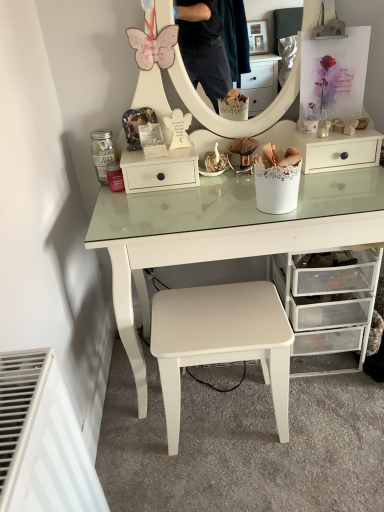
Locate an element on the screen. This screenshot has width=384, height=512. white matte stool at center is located at coordinates (221, 341).

The image size is (384, 512). What do you see at coordinates (160, 170) in the screenshot?
I see `white matte drawer at center` at bounding box center [160, 170].

I want to click on white matte stool at center, so click(x=221, y=341).

Does white matte drawer at center have a larger size compared to white matte stool at center?

No, white matte drawer at center is not bigger than white matte stool at center.

Does white matte drawer at center turn towards white matte stool at center?

No, white matte drawer at center is not facing towards white matte stool at center.

Would you consider white matte drawer at center to be distant from white matte stool at center?

No, white matte drawer at center is not far away from white matte stool at center.

Between point (140, 183) and point (157, 348), which one is positioned behind?

The point (140, 183) is more distant.

This screenshot has width=384, height=512. There is a white matte stool at center. Identify the location of the chest of drawers above it (from a real-world perspective). (328, 304).

How far apart are clear plastic drawers at lower right and white matte stool at center?

clear plastic drawers at lower right and white matte stool at center are 10.93 inches apart from each other.

Which is behind, clear plastic drawers at lower right or white matte stool at center?

clear plastic drawers at lower right is more distant.

How different are the orientations of clear plastic drawers at lower right and white matte stool at center in degrees?

176 degrees.

Is there a large distance between white matte stool at center and white matte drawer at center?

No.

Which is closer, (286,387) or (146,181)?

Point (286,387).

Looking at this image, between white matte stool at center and white matte drawer at center, which one has more height?

white matte stool at center.

Find the location of a particular element. The image size is (384, 512). nightstand located above the white matte stool at center (from the image's perspective) is located at coordinates (160, 170).

Considering the positions of point (216, 285) and point (354, 272), is point (216, 285) closer or farther from the camera than point (354, 272)?

Point (216, 285) appears to be farther away from the viewer than point (354, 272).

Which object is wider, white matte stool at center or clear plastic drawers at lower right?

clear plastic drawers at lower right.

Is white matte stool at center smaller than clear plastic drawers at lower right?

Yes.

Can you confirm if white matte stool at center is positioned to the right of clear plastic drawers at lower right?

No, white matte stool at center is not to the right of clear plastic drawers at lower right.

Based on the photo, which is further, (139, 189) or (368, 250)?

The point (139, 189) is farther.

Is white matte drawer at center surrounding clear plastic drawers at lower right?

Actually, clear plastic drawers at lower right is outside white matte drawer at center.

Does white matte drawer at center have a greater height compared to clear plastic drawers at lower right?

No.

From a real-world perspective, is white matte drawer at center located higher than clear plastic drawers at lower right?

Yes, from a real-world perspective, white matte drawer at center is above clear plastic drawers at lower right.

Who is shorter, clear plastic drawers at lower right or white matte drawer at center?

Standing shorter between the two is white matte drawer at center.

Consider the image. Considering the positions of objects clear plastic drawers at lower right and white matte drawer at center in the image provided, who is behind, clear plastic drawers at lower right or white matte drawer at center?

white matte drawer at center is behind.

In terms of size, does clear plastic drawers at lower right appear bigger or smaller than white matte drawer at center?

Considering their sizes, clear plastic drawers at lower right takes up more space than white matte drawer at center.

Is clear plastic drawers at lower right not inside white matte drawer at center?

Yes, clear plastic drawers at lower right is located beyond the bounds of white matte drawer at center.

This screenshot has width=384, height=512. What are the coordinates of `stool located on the right of white matte drawer at center` in the screenshot? It's located at (221, 341).

You are a GUI agent. You are given a task and a screenshot of the screen. Output one action in this format:
    pyautogui.click(x=<x>, y=<y>)
    Task: Click on the chest of drawers behind the white matte stool at center
    This screenshot has height=512, width=384.
    Given the screenshot: What is the action you would take?
    pyautogui.click(x=328, y=304)

Estimate the real-world distances between objects in this image. Which object is further from white matte drawer at center, clear plastic drawers at lower right or white matte stool at center?

clear plastic drawers at lower right.

Which object lies further to the anchor point white matte stool at center, clear plastic drawers at lower right or white matte drawer at center?

Based on the image, white matte drawer at center appears to be further to white matte stool at center.

Estimate the real-world distances between objects in this image. Which object is closer to clear plastic drawers at lower right, white matte drawer at center or white matte stool at center?

Among the two, white matte stool at center is located nearer to clear plastic drawers at lower right.

Based on the photo, considering their positions, is white matte stool at center positioned closer to white matte drawer at center than clear plastic drawers at lower right?

white matte stool at center is closer to white matte drawer at center.

Based on their spatial positions, is white matte drawer at center or clear plastic drawers at lower right further from white matte stool at center?

white matte drawer at center.

When comparing their distances from clear plastic drawers at lower right, does white matte stool at center or white matte drawer at center seem closer?

The object closer to clear plastic drawers at lower right is white matte stool at center.

Where is `the chest of drawers that lies between white matte drawer at center and white matte stool at center from top to bottom`? Image resolution: width=384 pixels, height=512 pixels. the chest of drawers that lies between white matte drawer at center and white matte stool at center from top to bottom is located at coordinates coord(328,304).